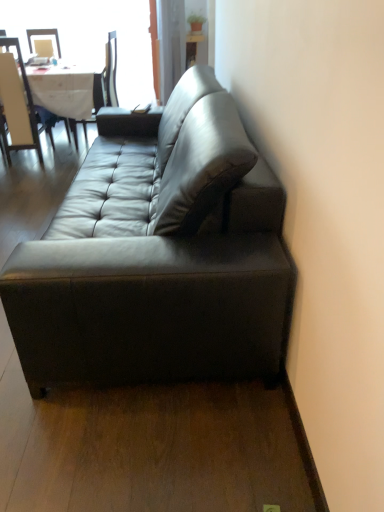
Question: Is matte black chair at upper left, the second chair in the left-to-right sequence, not within transparent glass window at upper left?

Choices:
 (A) yes
 (B) no

Answer: (A)

Question: From the image's perspective, is matte black chair at upper left, the first chair viewed from the right, under transparent glass window at upper left?

Choices:
 (A) yes
 (B) no

Answer: (A)

Question: Can you confirm if matte black chair at upper left, the second chair in the left-to-right sequence, is smaller than transparent glass window at upper left?

Choices:
 (A) yes
 (B) no

Answer: (B)

Question: From the image's perspective, does matte black chair at upper left, the second chair in the left-to-right sequence, appear higher than transparent glass window at upper left?

Choices:
 (A) no
 (B) yes

Answer: (A)

Question: Does matte black chair at upper left, the second chair in the left-to-right sequence, have a larger size compared to transparent glass window at upper left?

Choices:
 (A) no
 (B) yes

Answer: (B)

Question: Considering the positions of transparent glass window at upper left and white cloth table at upper left in the image, is transparent glass window at upper left bigger or smaller than white cloth table at upper left?

Choices:
 (A) small
 (B) big

Answer: (A)

Question: From their relative heights in the image, would you say transparent glass window at upper left is taller or shorter than white cloth table at upper left?

Choices:
 (A) tall
 (B) short

Answer: (A)

Question: From the image's perspective, relative to white cloth table at upper left, is transparent glass window at upper left above or below?

Choices:
 (A) above
 (B) below

Answer: (A)

Question: Is transparent glass window at upper left to the left or to the right of white cloth table at upper left in the image?

Choices:
 (A) left
 (B) right

Answer: (B)

Question: Is matte black couch at center inside the boundaries of white cloth table at upper left, or outside?

Choices:
 (A) inside
 (B) outside

Answer: (B)

Question: From a real-world perspective, is matte black couch at center positioned above or below white cloth table at upper left?

Choices:
 (A) below
 (B) above

Answer: (B)

Question: From the image's perspective, is matte black couch at center positioned above or below white cloth table at upper left?

Choices:
 (A) below
 (B) above

Answer: (A)

Question: Does point (61, 354) appear closer or farther from the camera than point (54, 67)?

Choices:
 (A) closer
 (B) farther

Answer: (A)

Question: From a real-world perspective, is white cloth table at upper left positioned above or below matte black chair at upper left, the first chair viewed from the right?

Choices:
 (A) above
 (B) below

Answer: (B)

Question: Which is correct: white cloth table at upper left is inside matte black chair at upper left, the first chair viewed from the right, or outside of it?

Choices:
 (A) outside
 (B) inside

Answer: (A)